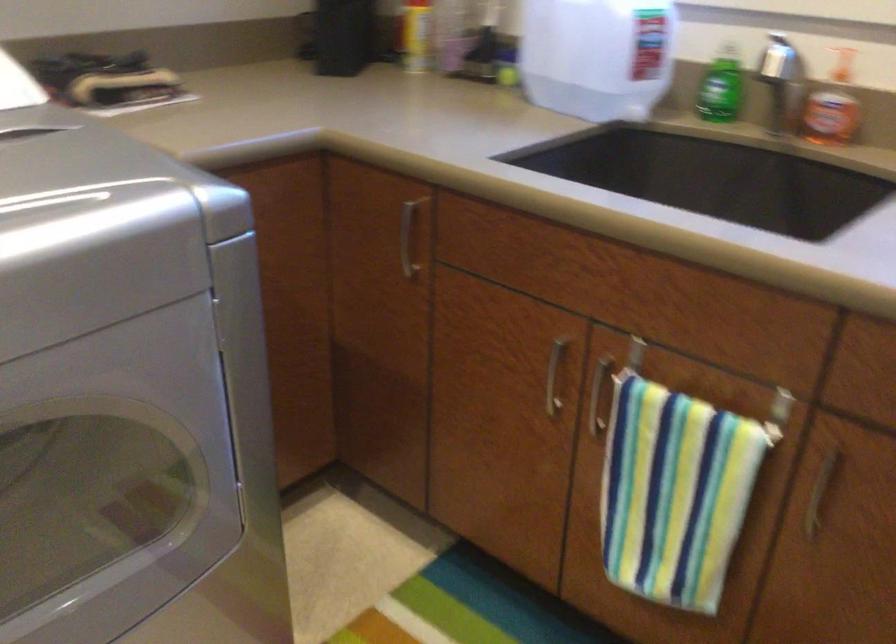
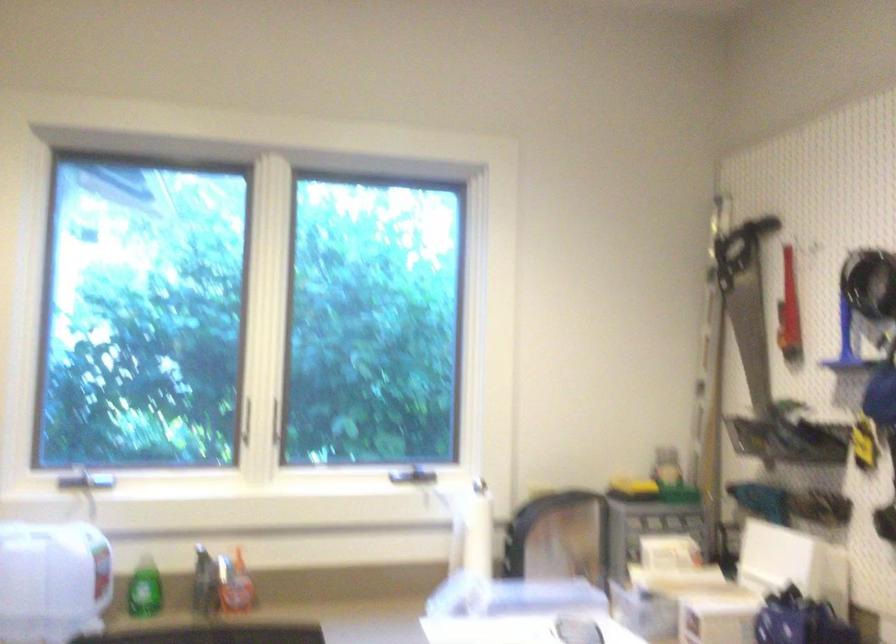
Based on the continuous images, in which direction is the camera rotating?

The camera rotated toward right-up.